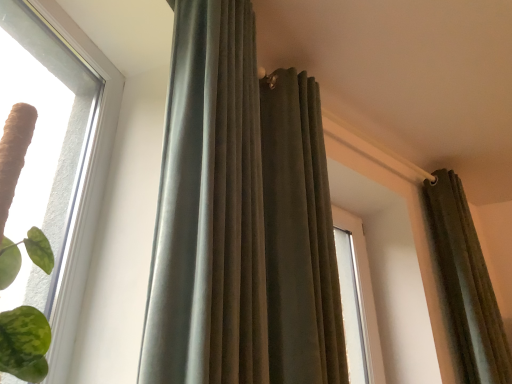
What do you see at coordinates (57, 157) in the screenshot?
I see `clear glass window at upper left` at bounding box center [57, 157].

This screenshot has height=384, width=512. I want to click on velvet olive curtain at upper right, which is the 3th curtain in left-to-right order, so click(465, 284).

Where is `velvet olive curtain at upper center, arranged as the 2th curtain when viewed from the right`? Image resolution: width=512 pixels, height=384 pixels. velvet olive curtain at upper center, arranged as the 2th curtain when viewed from the right is located at coordinates (298, 236).

Could you tell me if clear glass window at upper left is facing velvet olive curtain at upper center, arranged as the 2th curtain when viewed from the right?

No, clear glass window at upper left is not turned towards velvet olive curtain at upper center, arranged as the 2th curtain when viewed from the right.

Which object is closer to the camera taking this photo, clear glass window at upper left or velvet olive curtain at upper center, arranged as the 2th curtain when viewed from the right?

clear glass window at upper left.

Between clear glass window at upper left and velvet olive curtain at upper center, arranged as the 2th curtain when viewed from the right, which one has larger size?

velvet olive curtain at upper center, arranged as the 2th curtain when viewed from the right, is bigger.

Is velvet olive curtain at upper right, which is the 3th curtain in left-to-right order, surrounding velvet-like gray curtain at center, placed as the 3th curtain when sorted from right to left?

Actually, velvet-like gray curtain at center, placed as the 3th curtain when sorted from right to left, is outside velvet olive curtain at upper right, which is the 3th curtain in left-to-right order.

Considering the positions of point (458, 369) and point (209, 32), is point (458, 369) closer or farther from the camera than point (209, 32)?

Point (458, 369) is positioned farther from the camera compared to point (209, 32).

Is velvet olive curtain at upper right, which appears as the 1th curtain when viewed from the right, oriented towards velvet-like gray curtain at center, placed as the 3th curtain when sorted from right to left?

No, velvet olive curtain at upper right, which appears as the 1th curtain when viewed from the right, does not turn towards velvet-like gray curtain at center, placed as the 3th curtain when sorted from right to left.

Which object is positioned more to the right, velvet olive curtain at upper right, which appears as the 1th curtain when viewed from the right, or velvet-like gray curtain at center, the 1th curtain viewed from the left?

velvet olive curtain at upper right, which appears as the 1th curtain when viewed from the right, is more to the right.

From the image's perspective, which is above, velvet olive curtain at upper center, arranged as the 2th curtain when viewed from the right, or velvet-like gray curtain at center, placed as the 3th curtain when sorted from right to left?

velvet-like gray curtain at center, placed as the 3th curtain when sorted from right to left, appears higher in the image.

Does velvet olive curtain at upper center, positioned as the 2th curtain in left-to-right order, turn towards velvet-like gray curtain at center, the 1th curtain viewed from the left?

No, velvet olive curtain at upper center, positioned as the 2th curtain in left-to-right order, is not oriented towards velvet-like gray curtain at center, the 1th curtain viewed from the left.

Is velvet olive curtain at upper center, positioned as the 2th curtain in left-to-right order, directly adjacent to velvet-like gray curtain at center, the 1th curtain viewed from the left?

No, velvet olive curtain at upper center, positioned as the 2th curtain in left-to-right order, is not next to velvet-like gray curtain at center, the 1th curtain viewed from the left.

Considering the sizes of objects velvet olive curtain at upper center, arranged as the 2th curtain when viewed from the right, and velvet-like gray curtain at center, the 1th curtain viewed from the left, in the image provided, who is bigger, velvet olive curtain at upper center, arranged as the 2th curtain when viewed from the right, or velvet-like gray curtain at center, the 1th curtain viewed from the left,?

velvet olive curtain at upper center, arranged as the 2th curtain when viewed from the right, is bigger.

Which of these two, velvet olive curtain at upper center, arranged as the 2th curtain when viewed from the right, or clear glass window at upper left, stands taller?

velvet olive curtain at upper center, arranged as the 2th curtain when viewed from the right.

Is velvet olive curtain at upper center, positioned as the 2th curtain in left-to-right order, located outside clear glass window at upper left?

velvet olive curtain at upper center, positioned as the 2th curtain in left-to-right order, is positioned outside clear glass window at upper left.

In the image, there is a velvet olive curtain at upper center, arranged as the 2th curtain when viewed from the right. Where is `window below it (from a real-world perspective)`? The image size is (512, 384). window below it (from a real-world perspective) is located at coordinates (57, 157).

Who is more distant, velvet olive curtain at upper center, positioned as the 2th curtain in left-to-right order, or clear glass window at upper left?

velvet olive curtain at upper center, positioned as the 2th curtain in left-to-right order, is more distant.

Considering the relative positions of clear glass window at upper left and velvet olive curtain at upper right, which appears as the 1th curtain when viewed from the right, in the image provided, is clear glass window at upper left to the left of velvet olive curtain at upper right, which appears as the 1th curtain when viewed from the right, from the viewer's perspective?

Indeed, clear glass window at upper left is positioned on the left side of velvet olive curtain at upper right, which appears as the 1th curtain when viewed from the right.

From a real-world perspective, is clear glass window at upper left physically located above or below velvet olive curtain at upper right, which appears as the 1th curtain when viewed from the right?

clear glass window at upper left is below velvet olive curtain at upper right, which appears as the 1th curtain when viewed from the right.

In the scene shown: Is clear glass window at upper left aimed at velvet olive curtain at upper right, which is the 3th curtain in left-to-right order?

No, clear glass window at upper left is not facing towards velvet olive curtain at upper right, which is the 3th curtain in left-to-right order.

Considering the points (100, 62) and (464, 194), which point is in front, point (100, 62) or point (464, 194)?

Positioned in front is point (100, 62).

Considering the sizes of velvet-like gray curtain at center, the 1th curtain viewed from the left, and velvet olive curtain at upper center, positioned as the 2th curtain in left-to-right order, in the image, is velvet-like gray curtain at center, the 1th curtain viewed from the left, taller or shorter than velvet olive curtain at upper center, positioned as the 2th curtain in left-to-right order,?

In the image, velvet-like gray curtain at center, the 1th curtain viewed from the left, appears to be taller than velvet olive curtain at upper center, positioned as the 2th curtain in left-to-right order.

In terms of width, does velvet-like gray curtain at center, placed as the 3th curtain when sorted from right to left, look wider or thinner when compared to velvet olive curtain at upper center, positioned as the 2th curtain in left-to-right order?

Clearly, velvet-like gray curtain at center, placed as the 3th curtain when sorted from right to left, has less width compared to velvet olive curtain at upper center, positioned as the 2th curtain in left-to-right order.

From the image's perspective, would you say velvet-like gray curtain at center, placed as the 3th curtain when sorted from right to left, is shown under velvet olive curtain at upper center, positioned as the 2th curtain in left-to-right order?

No.

Which is correct: velvet olive curtain at upper center, arranged as the 2th curtain when viewed from the right, is inside velvet olive curtain at upper right, which is the 3th curtain in left-to-right order, or outside of it?

velvet olive curtain at upper center, arranged as the 2th curtain when viewed from the right, cannot be found inside velvet olive curtain at upper right, which is the 3th curtain in left-to-right order.

Based on the photo, does velvet olive curtain at upper center, arranged as the 2th curtain when viewed from the right, have a larger size compared to velvet olive curtain at upper right, which is the 3th curtain in left-to-right order?

Yes, velvet olive curtain at upper center, arranged as the 2th curtain when viewed from the right, is bigger than velvet olive curtain at upper right, which is the 3th curtain in left-to-right order.

Looking at this image, can you see velvet olive curtain at upper center, positioned as the 2th curtain in left-to-right order, touching velvet olive curtain at upper right, which is the 3th curtain in left-to-right order?

velvet olive curtain at upper center, positioned as the 2th curtain in left-to-right order, is not next to velvet olive curtain at upper right, which is the 3th curtain in left-to-right order, and they're not touching.

Considering the sizes of objects velvet olive curtain at upper center, positioned as the 2th curtain in left-to-right order, and velvet olive curtain at upper right, which appears as the 1th curtain when viewed from the right, in the image provided, who is thinner, velvet olive curtain at upper center, positioned as the 2th curtain in left-to-right order, or velvet olive curtain at upper right, which appears as the 1th curtain when viewed from the right,?

velvet olive curtain at upper right, which appears as the 1th curtain when viewed from the right, is thinner.

Image resolution: width=512 pixels, height=384 pixels. In order to click on window below the velvet olive curtain at upper center, arranged as the 2th curtain when viewed from the right (from a real-world perspective) in this screenshot , I will do `click(57, 157)`.

Starting from the velvet-like gray curtain at center, the 1th curtain viewed from the left, which curtain is the 2nd one to the right? Please provide its 2D coordinates.

[(465, 284)]

When comparing their distances from velvet olive curtain at upper right, which appears as the 1th curtain when viewed from the right, does velvet-like gray curtain at center, the 1th curtain viewed from the left, or velvet olive curtain at upper center, positioned as the 2th curtain in left-to-right order, seem closer?

Among the two, velvet olive curtain at upper center, positioned as the 2th curtain in left-to-right order, is located nearer to velvet olive curtain at upper right, which appears as the 1th curtain when viewed from the right.

Looking at the image, which one is located further to velvet olive curtain at upper right, which is the 3th curtain in left-to-right order, velvet-like gray curtain at center, placed as the 3th curtain when sorted from right to left, or clear glass window at upper left?

clear glass window at upper left is further to velvet olive curtain at upper right, which is the 3th curtain in left-to-right order.

From the image, which object appears to be farther from velvet-like gray curtain at center, placed as the 3th curtain when sorted from right to left, clear glass window at upper left or velvet olive curtain at upper center, arranged as the 2th curtain when viewed from the right?

The object further to velvet-like gray curtain at center, placed as the 3th curtain when sorted from right to left, is clear glass window at upper left.

Looking at the image, which one is located closer to velvet olive curtain at upper center, positioned as the 2th curtain in left-to-right order, velvet olive curtain at upper right, which appears as the 1th curtain when viewed from the right, or clear glass window at upper left?

clear glass window at upper left is closer to velvet olive curtain at upper center, positioned as the 2th curtain in left-to-right order.

In the scene shown: Based on their spatial positions, is velvet olive curtain at upper right, which is the 3th curtain in left-to-right order, or clear glass window at upper left further from velvet-like gray curtain at center, the 1th curtain viewed from the left?

Among the two, velvet olive curtain at upper right, which is the 3th curtain in left-to-right order, is located further to velvet-like gray curtain at center, the 1th curtain viewed from the left.

From the image, which object appears to be nearer to velvet olive curtain at upper right, which is the 3th curtain in left-to-right order, velvet olive curtain at upper center, arranged as the 2th curtain when viewed from the right, or clear glass window at upper left?

Based on the image, velvet olive curtain at upper center, arranged as the 2th curtain when viewed from the right, appears to be nearer to velvet olive curtain at upper right, which is the 3th curtain in left-to-right order.

Looking at the image, which one is located further to velvet olive curtain at upper right, which is the 3th curtain in left-to-right order, clear glass window at upper left or velvet-like gray curtain at center, placed as the 3th curtain when sorted from right to left?

clear glass window at upper left is further to velvet olive curtain at upper right, which is the 3th curtain in left-to-right order.

Estimate the real-world distances between objects in this image. Which object is closer to clear glass window at upper left, velvet olive curtain at upper right, which appears as the 1th curtain when viewed from the right, or velvet-like gray curtain at center, the 1th curtain viewed from the left?

velvet-like gray curtain at center, the 1th curtain viewed from the left, is positioned closer to the anchor clear glass window at upper left.

You are a GUI agent. You are given a task and a screenshot of the screen. Output one action in this format:
    pyautogui.click(x=<x>, y=<y>)
    Task: Click on the curtain situated between clear glass window at upper left and velvet olive curtain at upper center, arranged as the 2th curtain when viewed from the right, from left to right
    
    Given the screenshot: What is the action you would take?
    pyautogui.click(x=241, y=217)

Locate an element on the screen. Image resolution: width=512 pixels, height=384 pixels. curtain between velvet-like gray curtain at center, placed as the 3th curtain when sorted from right to left, and velvet olive curtain at upper right, which appears as the 1th curtain when viewed from the right, in the front-back direction is located at coordinates [298, 236].